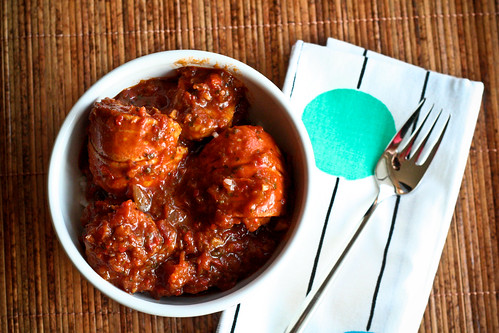
The image size is (499, 333). I want to click on bowl, so click(290, 240).